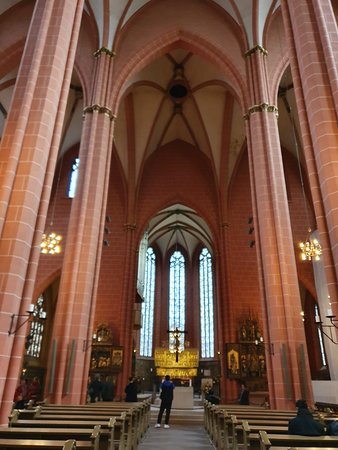
This screenshot has width=338, height=450. Identify the location of hanging light fixtures. (50, 246), (305, 253).